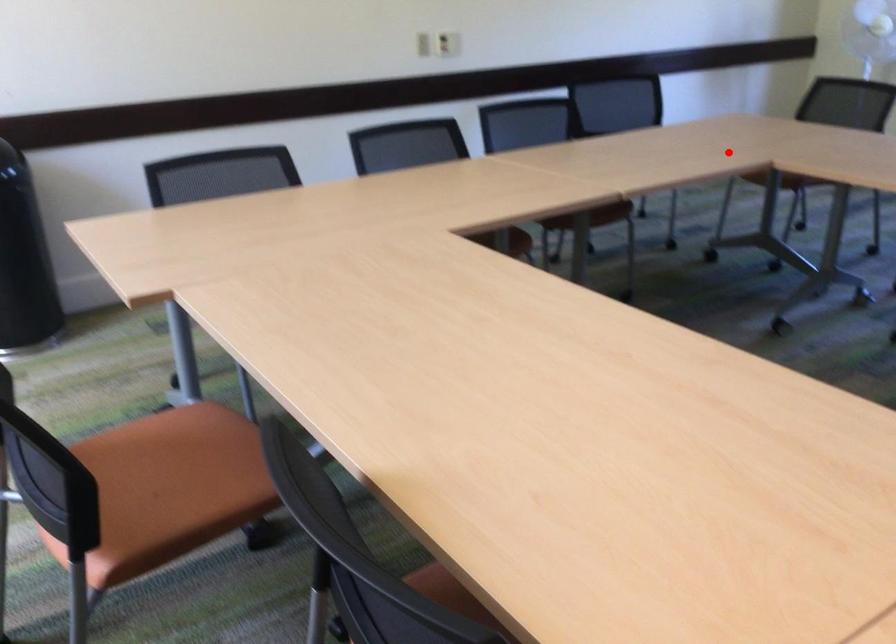
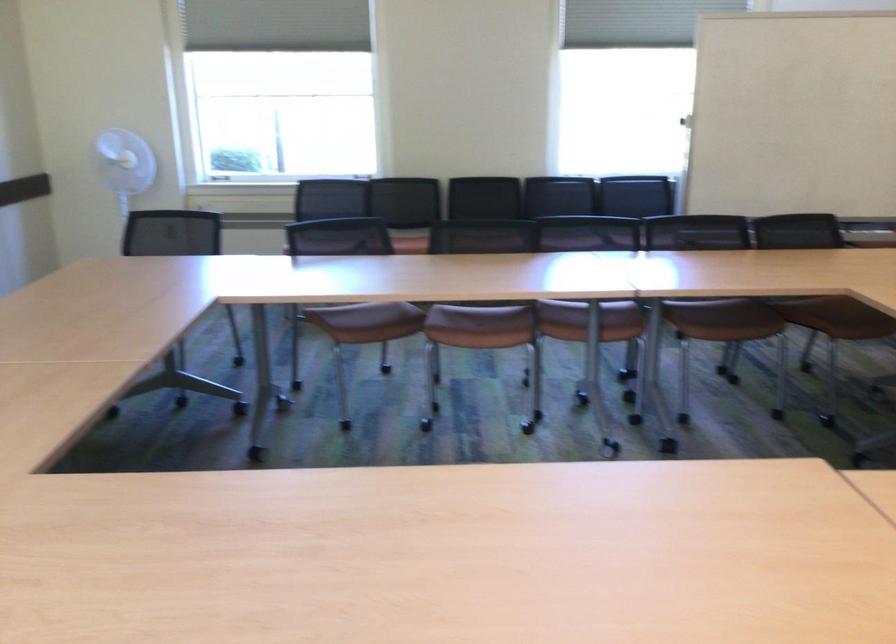
Where in the second image is the point corresponding to the highlighted location from the first image?

(177, 292)